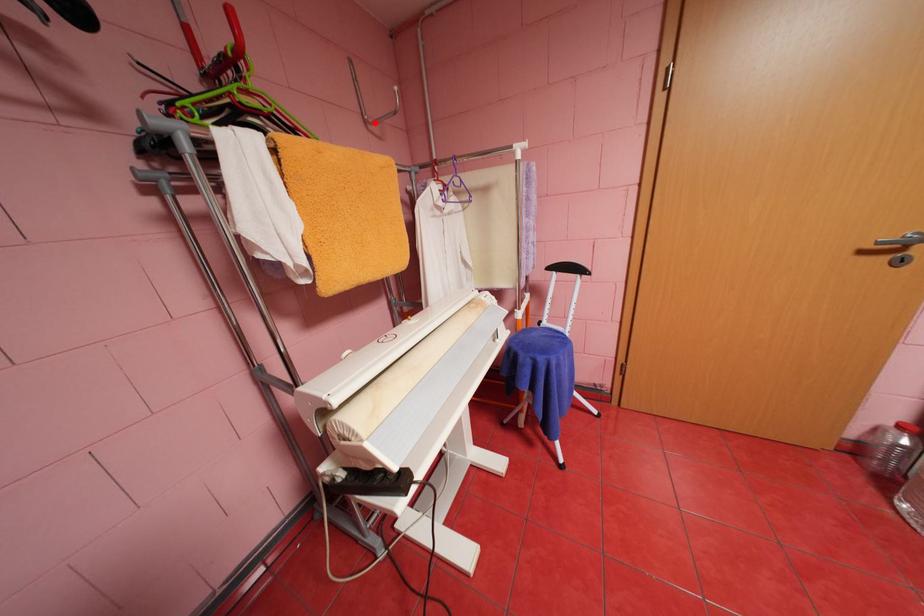
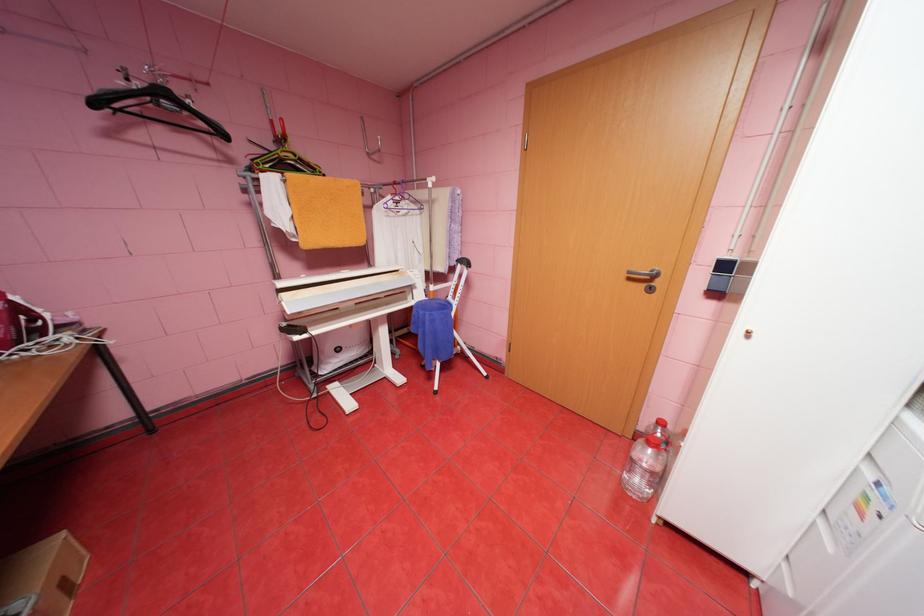
The point at the highlighted location is marked in the first image. Where is the corresponding point in the second image?

(377, 154)